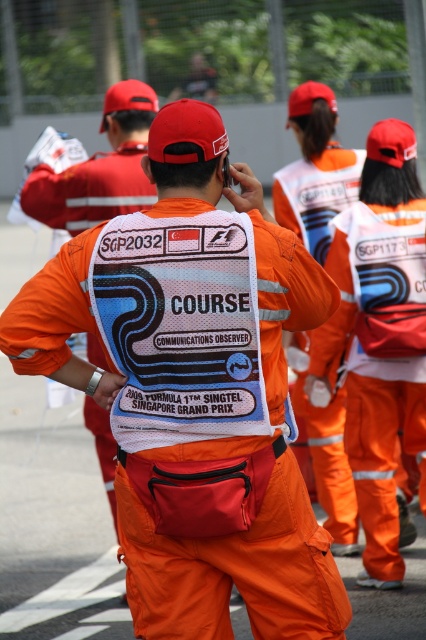
Based on the photo, you are a photographer at the Singapore Grand Prix. You need to capture a photo that includes both the orange reflective vest at center and the orange fabric vest at center. Which vest should you position closer to the camera to ensure both are fully visible in the frame?

The orange reflective vest at center is much taller than the orange fabric vest at center, so to ensure both are fully visible in the frame, position the orange reflective vest at center closer to the camera and the orange fabric vest at center further back.

You are a photographer at the 2009 Singapore Grand Prix and need to capture a clear shot of both the orange reflective vest at center and the orange fabric vest at center. Based on their positions, which vest should you focus on first to ensure both are in frame?

The orange reflective vest at center is located below the orange fabric vest at center, so you should focus on the orange fabric vest at center first to ensure both are in frame.

From the picture: You are a photographer at the 2009 Singapore Grand Prix and want to capture both the orange reflective vest at center and the orange fabric vest at center in a single shot. Which vest should you position your camera to the left of to ensure both are in frame?

You should position your camera to the left of the orange fabric vest at center. Since the orange reflective vest at center is to the right of the orange fabric vest at center, placing the camera to the left of the fabric vest ensures both vests are included in the frame.